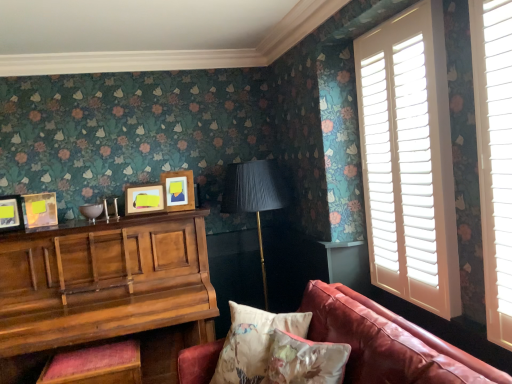
Question: Considering the relative positions of matte wooden picture frame at center, which appears as the first picture frame when viewed from the right, and matte yellow picture frame at left, the 3th picture frame viewed from the right, in the image provided, is matte wooden picture frame at center, which appears as the first picture frame when viewed from the right, in front of matte yellow picture frame at left, the 3th picture frame viewed from the right,?

Choices:
 (A) yes
 (B) no

Answer: (B)

Question: Would you consider matte wooden picture frame at center, positioned as the 4th picture frame in left-to-right order, to be distant from matte yellow picture frame at left, the 2th picture frame when ordered from left to right?

Choices:
 (A) no
 (B) yes

Answer: (A)

Question: Is matte wooden picture frame at center, which appears as the first picture frame when viewed from the right, bigger than matte yellow picture frame at left, the 3th picture frame viewed from the right?

Choices:
 (A) yes
 (B) no

Answer: (A)

Question: Considering the relative positions of matte wooden picture frame at center, which appears as the first picture frame when viewed from the right, and matte yellow picture frame at left, the 3th picture frame viewed from the right, in the image provided, is matte wooden picture frame at center, which appears as the first picture frame when viewed from the right, to the left of matte yellow picture frame at left, the 3th picture frame viewed from the right, from the viewer's perspective?

Choices:
 (A) yes
 (B) no

Answer: (B)

Question: From the image's perspective, would you say matte wooden picture frame at center, positioned as the 4th picture frame in left-to-right order, is positioned over matte yellow picture frame at left, the 2th picture frame when ordered from left to right?

Choices:
 (A) no
 (B) yes

Answer: (B)

Question: From their relative heights in the image, would you say matte wooden picture frame at left, which is the first picture frame from left to right, is taller or shorter than matte yellow picture frame at left, the 2th picture frame when ordered from left to right?

Choices:
 (A) short
 (B) tall

Answer: (B)

Question: Based on their sizes in the image, would you say matte wooden picture frame at left, arranged as the 4th picture frame when viewed from the right, is bigger or smaller than matte yellow picture frame at left, the 2th picture frame when ordered from left to right?

Choices:
 (A) big
 (B) small

Answer: (B)

Question: Choose the correct answer: Is matte wooden picture frame at left, arranged as the 4th picture frame when viewed from the right, inside matte yellow picture frame at left, the 2th picture frame when ordered from left to right, or outside it?

Choices:
 (A) inside
 (B) outside

Answer: (B)

Question: In the image, is matte wooden picture frame at left, arranged as the 4th picture frame when viewed from the right, on the left side or the right side of matte yellow picture frame at left, the 2th picture frame when ordered from left to right?

Choices:
 (A) right
 (B) left

Answer: (B)

Question: Which is correct: matte wooden picture frame at left, which is the first picture frame from left to right, is inside leather couch at lower right, or outside of it?

Choices:
 (A) outside
 (B) inside

Answer: (A)

Question: From the image's perspective, is matte wooden picture frame at left, arranged as the 4th picture frame when viewed from the right, located above or below leather couch at lower right?

Choices:
 (A) above
 (B) below

Answer: (A)

Question: Is point (13, 221) positioned closer to the camera than point (412, 362)?

Choices:
 (A) closer
 (B) farther

Answer: (B)

Question: In the image, is matte wooden picture frame at left, arranged as the 4th picture frame when viewed from the right, positioned in front of or behind leather couch at lower right?

Choices:
 (A) front
 (B) behind

Answer: (B)

Question: Is point (98, 249) positioned closer to the camera than point (264, 314)?

Choices:
 (A) farther
 (B) closer

Answer: (A)

Question: Is wooden piano at left bigger or smaller than floral fabric cushion at lower center?

Choices:
 (A) big
 (B) small

Answer: (A)